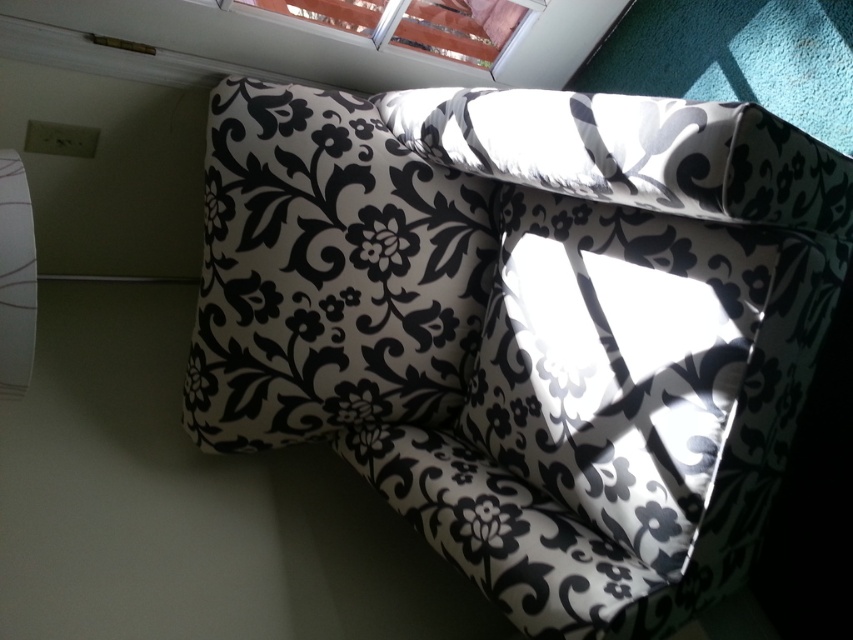
Does black floral fabric couch at center have a lesser width compared to metallic silver blinds at upper center?

In fact, black floral fabric couch at center might be wider than metallic silver blinds at upper center.

Does black floral fabric couch at center appear on the left side of metallic silver blinds at upper center?

In fact, black floral fabric couch at center is to the right of metallic silver blinds at upper center.

Is point (505, 397) less distant than point (471, 4)?

Yes, it is.

Locate an element on the screen. black floral fabric couch at center is located at coordinates (525, 324).

Is black floral cushion at center further to camera compared to metallic silver blinds at upper center?

No, it is in front of metallic silver blinds at upper center.

Image resolution: width=853 pixels, height=640 pixels. I want to click on black floral cushion at center, so click(618, 362).

Does black floral fabric couch at center appear over black floral cushion at center?

Yes, black floral fabric couch at center is above black floral cushion at center.

Locate an element on the screen. The height and width of the screenshot is (640, 853). black floral fabric couch at center is located at coordinates (525, 324).

Is point (809, 244) positioned behind point (503, 372)?

That is False.

In order to click on black floral fabric couch at center in this screenshot , I will do `click(525, 324)`.